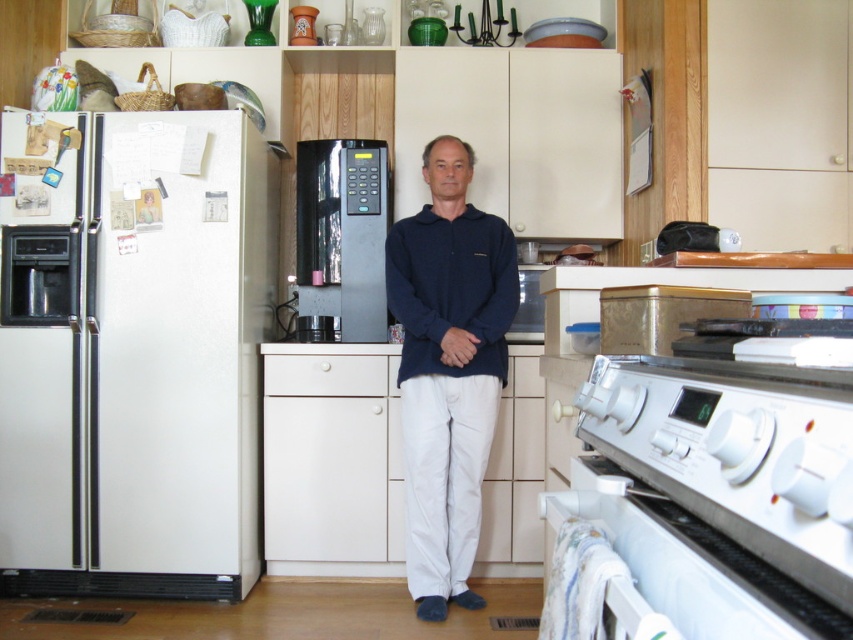
Does point (428, 147) come in front of point (306, 228)?

That is True.

Where is `navy blue sweater at center`? The height and width of the screenshot is (640, 853). navy blue sweater at center is located at coordinates (448, 369).

Locate an element on the screen. The image size is (853, 640). white matte refrigerator at left is located at coordinates pyautogui.click(x=132, y=353).

Consider the image. Is white matte refrigerator at left wider than black plastic microwave at center?

Correct, the width of white matte refrigerator at left exceeds that of black plastic microwave at center.

Does point (206, 208) come behind point (381, 228)?

No, (206, 208) is in front of (381, 228).

Identify the location of white matte refrigerator at left. This screenshot has width=853, height=640. (132, 353).

Between white glossy oven at lower right and black plastic microwave at center, which one appears on the left side from the viewer's perspective?

From the viewer's perspective, black plastic microwave at center appears more on the left side.

Is white glossy oven at lower right wider than black plastic microwave at center?

No.

Between point (821, 401) and point (334, 177), which one is positioned in front?

Point (821, 401) is more forward.

Find the location of a particular element. This screenshot has width=853, height=640. white glossy oven at lower right is located at coordinates (717, 497).